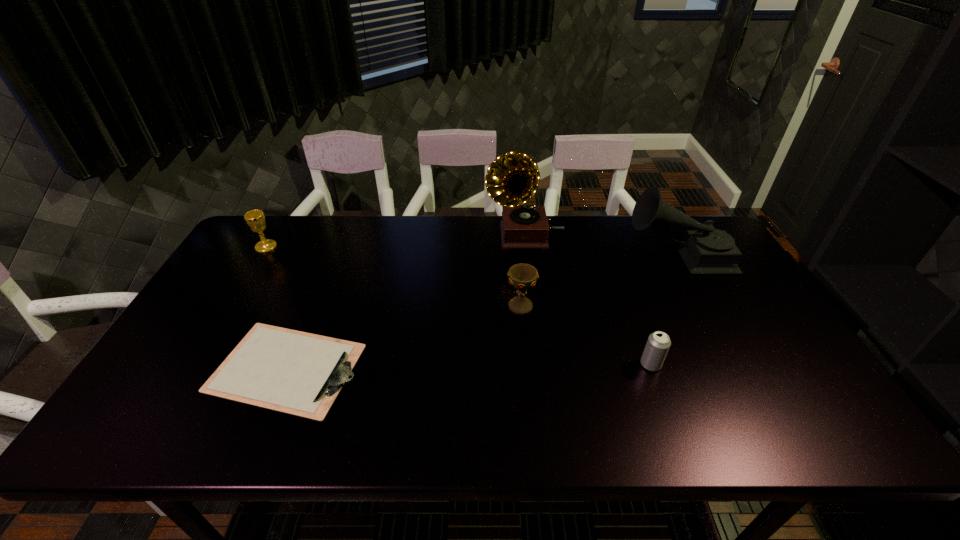
Identify the location of vacant region located 0.270m on the back of the second shortest object. (622, 285).

Find the location of a particular element. vacant region located 0.170m on the back of the clipboard is located at coordinates (322, 282).

This screenshot has height=540, width=960. I want to click on chalice situated at the far edge, so click(255, 219).

Where is `object situated at the near edge`? object situated at the near edge is located at coordinates click(298, 373).

Where is `chalice located in the left edge section of the desktop`? This screenshot has height=540, width=960. chalice located in the left edge section of the desktop is located at coordinates (255, 219).

Find the location of a particular element. The image size is (960, 540). clipboard that is positioned at the left edge is located at coordinates (298, 373).

The image size is (960, 540). Identify the location of object that is positioned at the right edge. (705, 250).

You are a GUI agent. You are given a task and a screenshot of the screen. Output one action in this format:
    pyautogui.click(x=<x>, y=<y>)
    Task: Click on the object present at the far left corner
    
    Given the screenshot: What is the action you would take?
    pyautogui.click(x=255, y=219)

I want to click on object present at the near left corner, so click(298, 373).

Identify the location of object situated at the far right corner. This screenshot has height=540, width=960. (705, 250).